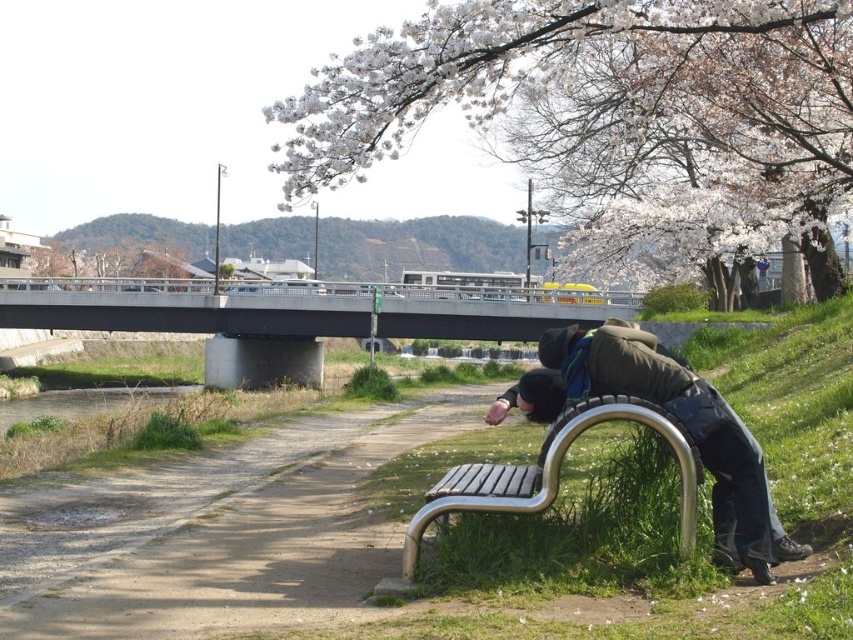
Question: Is white blossoms at upper center smaller than wooden slats bench at lower center?

Choices:
 (A) yes
 (B) no

Answer: (B)

Question: Which point appears farthest from the camera in this image?

Choices:
 (A) (686, 364)
 (B) (375, 122)
 (C) (183, 548)

Answer: (B)

Question: Estimate the real-world distances between objects in this image. Which object is closer to the dirt path at lower left?

Choices:
 (A) white blossoms at upper center
 (B) wooden slats bench at lower center
 (C) matte green jacket at lower right

Answer: (B)

Question: Does dirt path at lower left appear on the right side of wooden slats bench at lower center?

Choices:
 (A) no
 (B) yes

Answer: (A)

Question: Considering the real-world distances, which object is closest to the wooden slats bench at lower center?

Choices:
 (A) matte green jacket at lower right
 (B) dirt path at lower left

Answer: (A)

Question: Can you confirm if matte green jacket at lower right is thinner than wooden slats bench at lower center?

Choices:
 (A) yes
 (B) no

Answer: (A)